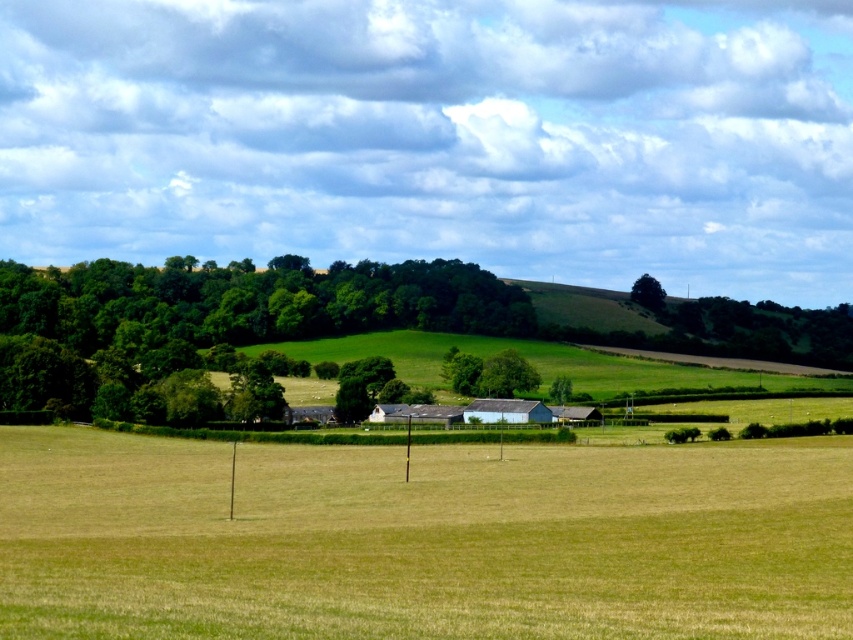
Question: Estimate the real-world distances between objects in this image. Which object is farther from the green leafy tree at upper right?

Choices:
 (A) green leafy tree at center
 (B) green grass at center
 (C) green leafy trees at center

Answer: (B)

Question: Is green leafy tree at center bigger than green leafy tree at upper right?

Choices:
 (A) yes
 (B) no

Answer: (B)

Question: Can you confirm if green leafy tree at center is positioned above green leafy tree at upper right?

Choices:
 (A) no
 (B) yes

Answer: (A)

Question: Can you confirm if green grass at center is positioned to the right of green leafy tree at center?

Choices:
 (A) no
 (B) yes

Answer: (B)

Question: Which of the following is the closest to the observer?

Choices:
 (A) green leafy tree at center
 (B) green leafy tree at upper right
 (C) green leafy trees at center
 (D) green grass at center

Answer: (D)

Question: Which of the following is the closest to the observer?

Choices:
 (A) (738, 632)
 (B) (79, 368)
 (C) (640, 296)

Answer: (A)